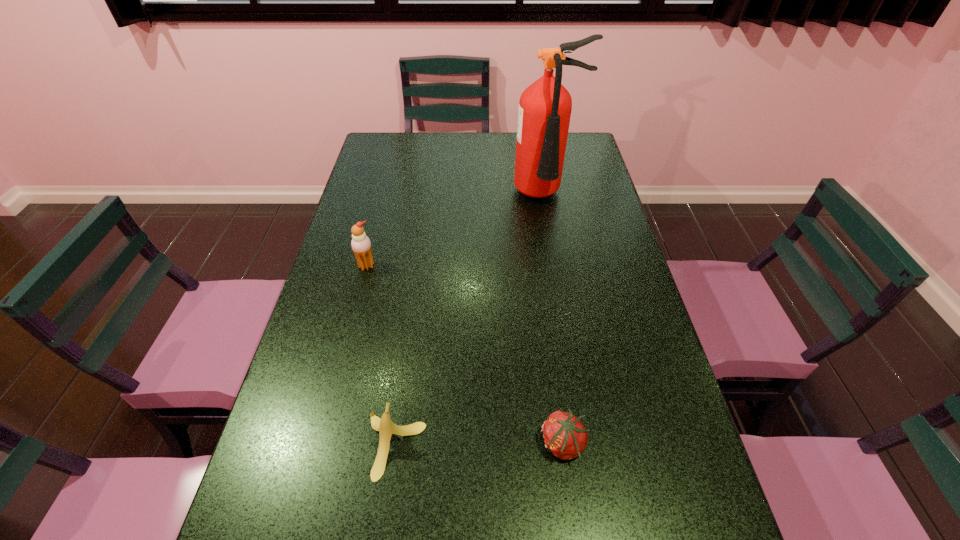
Locate an element on the screen. The height and width of the screenshot is (540, 960). free region located 0.180m on the right of the tomato is located at coordinates (672, 444).

This screenshot has height=540, width=960. I want to click on object present at the left edge, so click(x=361, y=245).

What are the coordinates of `object that is at the right edge` in the screenshot? It's located at (545, 107).

In the image, there is a desktop. At what (x,y) coordinates should I click in order to perform the action: click on vacant space at the far edge. Please return your answer as a coordinate pair (x, y). The image size is (960, 540). Looking at the image, I should click on (487, 152).

Image resolution: width=960 pixels, height=540 pixels. Identify the location of vacant space at the left edge. (320, 409).

At what (x,y) coordinates should I click in order to perform the action: click on vacant area at the right edge of the desktop. Please return your answer as a coordinate pair (x, y). Image resolution: width=960 pixels, height=540 pixels. Looking at the image, I should click on (593, 359).

The image size is (960, 540). Find the location of `free spot at the far right corner of the desktop`. free spot at the far right corner of the desktop is located at coordinates (574, 150).

You are a GUI agent. You are given a task and a screenshot of the screen. Output one action in this format:
    pyautogui.click(x=<x>, y=<y>)
    Task: Click on the vacant area that lies between the second farthest object and the farthest object
    The image size is (960, 540).
    Given the screenshot: What is the action you would take?
    pyautogui.click(x=456, y=231)

Identify the location of empty space that is in between the icecream and the fire extinguisher. (456, 231).

Where is `vacant point located between the second object from left to right and the shortest object`? vacant point located between the second object from left to right and the shortest object is located at coordinates click(x=479, y=444).